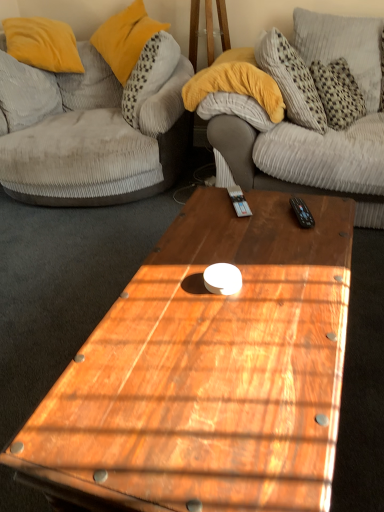
Question: From a real-world perspective, is velvet grey couch at left under black plastic remote control at upper right?

Choices:
 (A) no
 (B) yes

Answer: (A)

Question: Is velvet grey couch at left far away from black plastic remote control at upper right?

Choices:
 (A) yes
 (B) no

Answer: (A)

Question: Can you confirm if velvet grey couch at left is smaller than black plastic remote control at upper right?

Choices:
 (A) yes
 (B) no

Answer: (B)

Question: Is velvet grey couch at left positioned with its back to black plastic remote control at upper right?

Choices:
 (A) yes
 (B) no

Answer: (B)

Question: Does velvet grey couch at left appear on the left side of black plastic remote control at upper right?

Choices:
 (A) no
 (B) yes

Answer: (B)

Question: Is velvet grey couch at left taller than black plastic remote control at upper right?

Choices:
 (A) no
 (B) yes

Answer: (B)

Question: Considering the relative positions of gray corduroy pillow at upper right, positioned as the 3th pillow in left-to-right order, and velvet grey couch at left in the image provided, is gray corduroy pillow at upper right, positioned as the 3th pillow in left-to-right order, to the left of velvet grey couch at left from the viewer's perspective?

Choices:
 (A) no
 (B) yes

Answer: (A)

Question: Is gray corduroy pillow at upper right, positioned as the 3th pillow in left-to-right order, positioned far away from velvet grey couch at left?

Choices:
 (A) yes
 (B) no

Answer: (A)

Question: Can you confirm if gray corduroy pillow at upper right, the 1th pillow when ordered from right to left, is bigger than velvet grey couch at left?

Choices:
 (A) no
 (B) yes

Answer: (A)

Question: Is gray corduroy pillow at upper right, the 1th pillow when ordered from right to left, located outside velvet grey couch at left?

Choices:
 (A) yes
 (B) no

Answer: (A)

Question: Can you confirm if gray corduroy pillow at upper right, the 1th pillow when ordered from right to left, is smaller than velvet grey couch at left?

Choices:
 (A) no
 (B) yes

Answer: (B)

Question: Does gray corduroy pillow at upper right, positioned as the 3th pillow in left-to-right order, have a lesser width compared to velvet grey couch at left?

Choices:
 (A) no
 (B) yes

Answer: (B)

Question: Considering the relative sizes of black plastic remote control at upper right and wooden coffee table at center in the image provided, is black plastic remote control at upper right thinner than wooden coffee table at center?

Choices:
 (A) yes
 (B) no

Answer: (A)